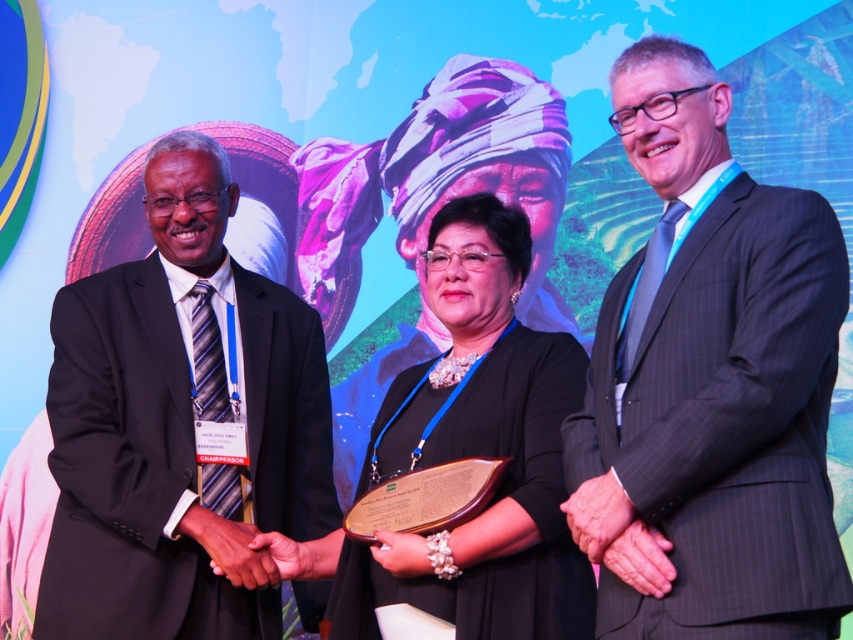
Which is more to the right, gray pinstripe suit at center or black pinstripe suit at left?

gray pinstripe suit at center is more to the right.

Which is behind, point (767, 365) or point (281, 314)?

Point (281, 314)

Where is `gray pinstripe suit at center`? gray pinstripe suit at center is located at coordinates (709, 385).

Who is positioned more to the right, black pinstripe suit at left or black satin dress at center?

From the viewer's perspective, black satin dress at center appears more on the right side.

Who is more forward, (183, 611) or (508, 252)?

Point (183, 611) is in front.

Find the location of a particular element. black pinstripe suit at left is located at coordinates (180, 426).

Can you confirm if gray pinstripe suit at center is wider than black satin dress at center?

In fact, gray pinstripe suit at center might be narrower than black satin dress at center.

Can you confirm if gray pinstripe suit at center is shorter than black satin dress at center?

In fact, gray pinstripe suit at center may be taller than black satin dress at center.

Locate an element on the screen. This screenshot has height=640, width=853. gray pinstripe suit at center is located at coordinates (709, 385).

I want to click on gray pinstripe suit at center, so click(709, 385).